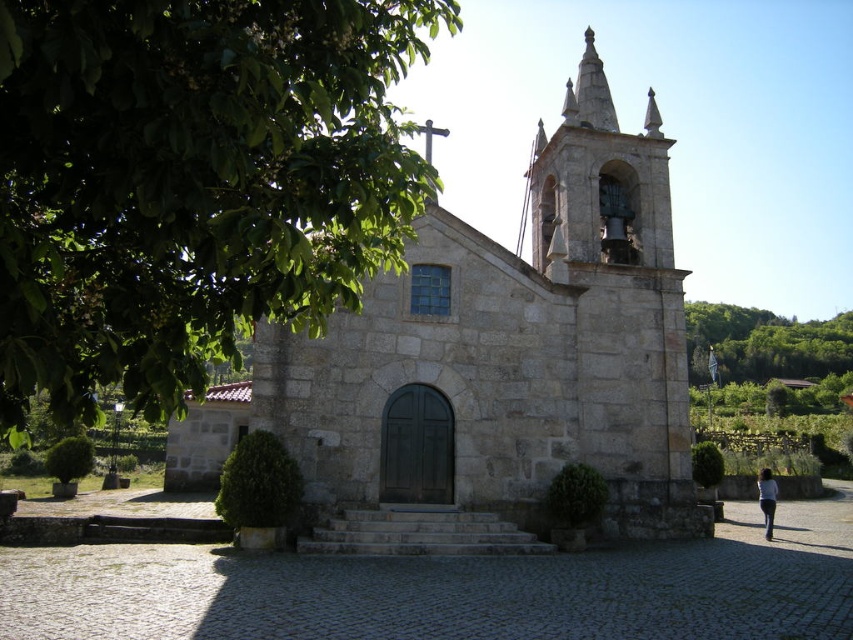
Question: Is green leafy tree at upper left positioned before dark blue fabric at lower right?

Choices:
 (A) no
 (B) yes

Answer: (B)

Question: Which point is closer to the camera?

Choices:
 (A) stone church at center
 (B) white fabric person at lower right
 (C) green leafy tree at upper left

Answer: (C)

Question: Observing the image, what is the correct spatial positioning of dark blue fabric at lower right in reference to white fabric person at lower right?

Choices:
 (A) right
 (B) left

Answer: (B)

Question: Which is farther from the white fabric person at lower right?

Choices:
 (A) dark blue fabric at lower right
 (B) green leafy tree at upper left
 (C) stone church at center

Answer: (B)

Question: Does green leafy tree at upper left appear on the right side of white fabric person at lower right?

Choices:
 (A) no
 (B) yes

Answer: (A)

Question: Based on their relative distances, which object is farther from the white fabric person at lower right?

Choices:
 (A) stone church at center
 (B) dark blue fabric at lower right

Answer: (A)